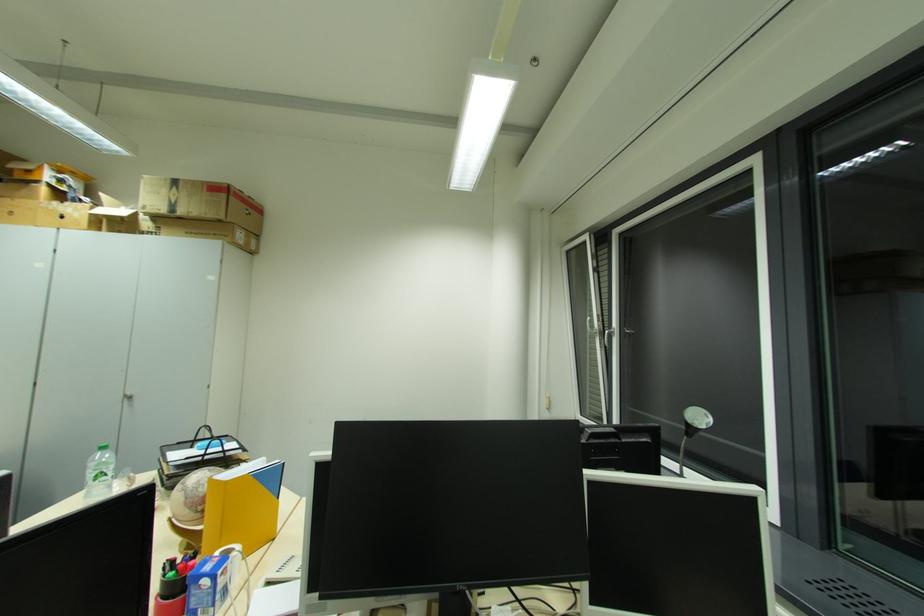
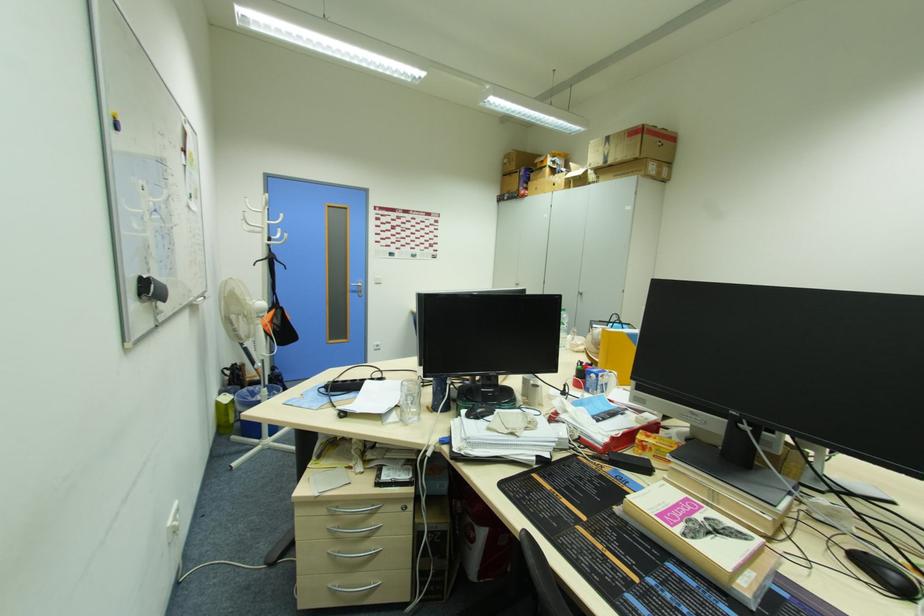
Question: The first image is from the beginning of the video and the second image is from the end. How did the camera likely rotate when shooting the video?

Choices:
 (A) Left
 (B) Right
 (C) Up
 (D) Down

Answer: (A)